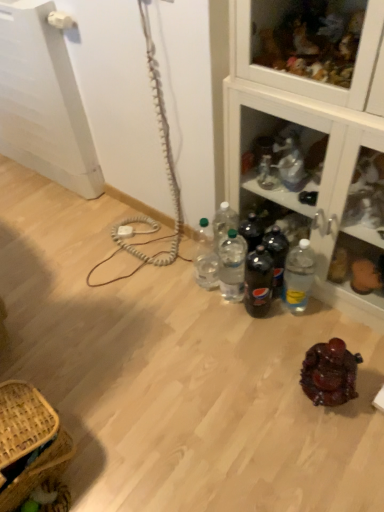
You are a GUI agent. You are given a task and a screenshot of the screen. Output one action in this format:
    pyautogui.click(x=<x>, y=<y>)
    Task: Click on the vacant point to the right of clear plastic bottle at lower right, which is counted as the fifth bottle, starting from the left
    
    Given the screenshot: What is the action you would take?
    pyautogui.click(x=332, y=313)